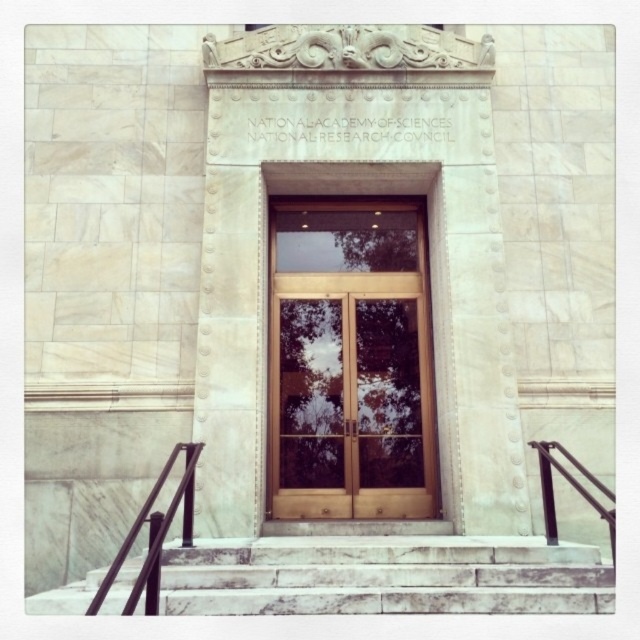
Question: Does glossy wood door at center come in front of white marble stairs at center?

Choices:
 (A) yes
 (B) no

Answer: (B)

Question: Which point is farther to the camera?

Choices:
 (A) white marble stairs at center
 (B) glossy wood door at center
 (C) black metal railing at lower left

Answer: (B)

Question: Which object appears closest to the camera in this image?

Choices:
 (A) white marble stairs at center
 (B) black metal railing at right

Answer: (A)

Question: Which point is closer to the camera taking this photo?

Choices:
 (A) (611, 496)
 (B) (372, 454)
 (C) (115, 577)

Answer: (C)

Question: Is glossy wood door at center further to the viewer compared to black metal railing at lower left?

Choices:
 (A) yes
 (B) no

Answer: (A)

Question: Considering the relative positions of black metal railing at lower left and black metal railing at right in the image provided, where is black metal railing at lower left located with respect to black metal railing at right?

Choices:
 (A) right
 (B) left

Answer: (B)